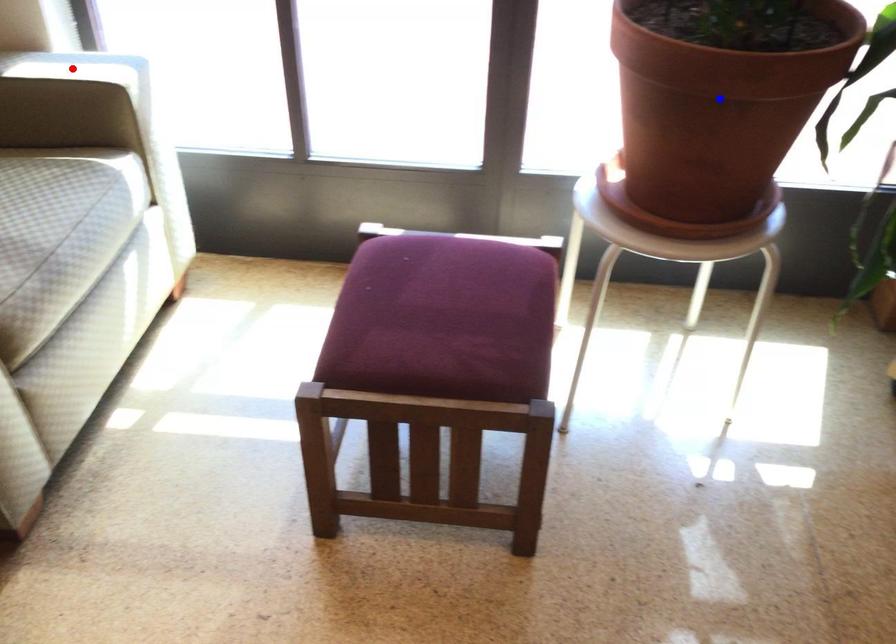
Question: Two points are marked on the image. Which point is closer to the camera?

Choices:
 (A) Blue point is closer.
 (B) Red point is closer.

Answer: (A)